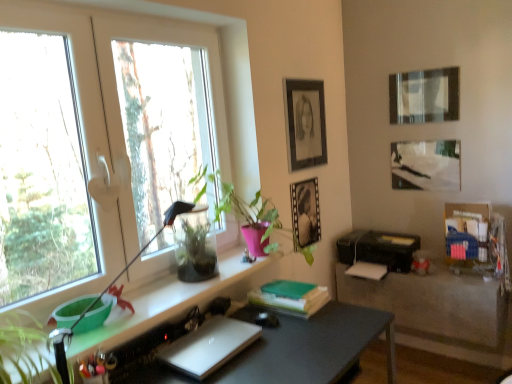
Question: Should I look upward or downward to see matte black picture frame at upper right, arranged as the 3th picture frame when viewed from the left?

Choices:
 (A) up
 (B) down

Answer: (A)

Question: Does metallic silver picture frame at center, the second picture frame from the left, have a lesser height compared to matte gray desk at center?

Choices:
 (A) no
 (B) yes

Answer: (B)

Question: From the image's perspective, is metallic silver picture frame at center, the second picture frame from the left, on matte gray desk at center?

Choices:
 (A) yes
 (B) no

Answer: (A)

Question: From a real-world perspective, is metallic silver picture frame at center, the 3th picture frame positioned from the right, below matte gray desk at center?

Choices:
 (A) no
 (B) yes

Answer: (A)

Question: Is metallic silver picture frame at center, the 3th picture frame positioned from the right, outside of matte gray desk at center?

Choices:
 (A) no
 (B) yes

Answer: (B)

Question: Is matte gray desk at center inside metallic silver picture frame at center, the 3th picture frame positioned from the right?

Choices:
 (A) yes
 (B) no

Answer: (B)

Question: Considering the relative sizes of metallic silver picture frame at center, the second picture frame from the left, and matte gray desk at center in the image provided, is metallic silver picture frame at center, the second picture frame from the left, smaller than matte gray desk at center?

Choices:
 (A) yes
 (B) no

Answer: (A)

Question: Can you confirm if matte black table at lower right is smaller than green matte book at center?

Choices:
 (A) yes
 (B) no

Answer: (B)

Question: Is matte black table at lower right behind green matte book at center?

Choices:
 (A) yes
 (B) no

Answer: (A)

Question: From a real-world perspective, is matte black table at lower right beneath green matte book at center?

Choices:
 (A) no
 (B) yes

Answer: (B)

Question: Is matte black table at lower right in front of green matte book at center?

Choices:
 (A) yes
 (B) no

Answer: (B)

Question: Is green matte book at center completely or partially inside matte black table at lower right?

Choices:
 (A) no
 (B) yes

Answer: (A)

Question: From a real-world perspective, does matte black table at lower right stand above green matte book at center?

Choices:
 (A) no
 (B) yes

Answer: (A)

Question: Is green glossy plant at center thinner than black plastic printer at lower right?

Choices:
 (A) no
 (B) yes

Answer: (B)